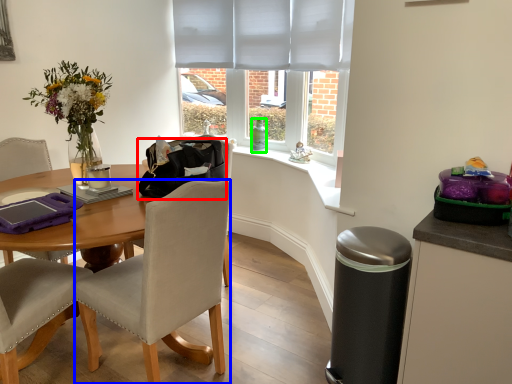
Question: Estimate the real-world distances between objects in this image. Which object is farther from handbag (highlighted by a red box), chair (highlighted by a blue box) or bottle (highlighted by a green box)?

Choices:
 (A) chair
 (B) bottle

Answer: (B)